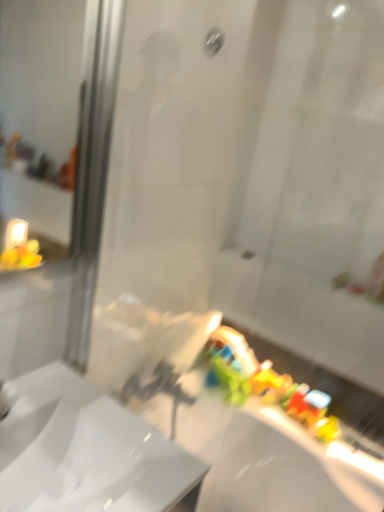
Question: Is matte silver shower at upper center to the right of white glossy sink at center from the viewer's perspective?

Choices:
 (A) yes
 (B) no

Answer: (A)

Question: Is matte silver shower at upper center surrounding white glossy sink at center?

Choices:
 (A) no
 (B) yes

Answer: (A)

Question: Considering the relative sizes of matte silver shower at upper center and white glossy sink at center in the image provided, is matte silver shower at upper center shorter than white glossy sink at center?

Choices:
 (A) no
 (B) yes

Answer: (B)

Question: Can you confirm if matte silver shower at upper center is bigger than white glossy sink at center?

Choices:
 (A) no
 (B) yes

Answer: (A)

Question: Is the depth of matte silver shower at upper center greater than that of white glossy sink at center?

Choices:
 (A) yes
 (B) no

Answer: (A)

Question: Is matte silver shower at upper center wider or thinner than white glossy bath at lower right?

Choices:
 (A) thin
 (B) wide

Answer: (A)

Question: Relative to white glossy bath at lower right, is matte silver shower at upper center in front or behind?

Choices:
 (A) behind
 (B) front

Answer: (A)

Question: Is point (208, 50) closer or farther from the camera than point (122, 325)?

Choices:
 (A) farther
 (B) closer

Answer: (B)

Question: From a real-world perspective, is matte silver shower at upper center physically located above or below white glossy bath at lower right?

Choices:
 (A) below
 (B) above

Answer: (B)

Question: Choose the correct answer: Is white glossy bath at lower right inside matte silver shower at upper center or outside it?

Choices:
 (A) outside
 (B) inside

Answer: (A)

Question: From the image's perspective, relative to matte silver shower at upper center, is white glossy bath at lower right above or below?

Choices:
 (A) above
 (B) below

Answer: (B)

Question: Considering the positions of white glossy bath at lower right and matte silver shower at upper center in the image, is white glossy bath at lower right wider or thinner than matte silver shower at upper center?

Choices:
 (A) wide
 (B) thin

Answer: (A)

Question: Based on their sizes in the image, would you say white glossy bath at lower right is bigger or smaller than matte silver shower at upper center?

Choices:
 (A) big
 (B) small

Answer: (A)

Question: Is matte silver shower at upper center bigger or smaller than white glossy sink at center?

Choices:
 (A) big
 (B) small

Answer: (B)

Question: In the image, is matte silver shower at upper center on the left side or the right side of white glossy sink at center?

Choices:
 (A) left
 (B) right

Answer: (B)